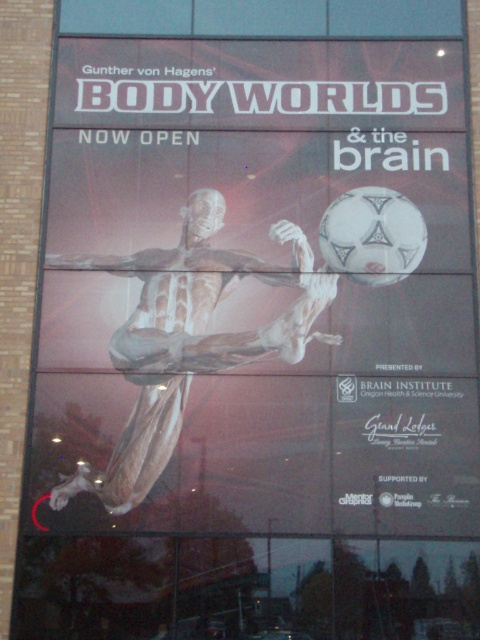
Is point (394, 68) in front of point (120, 364)?

No, it is not.

The image size is (480, 640). Describe the element at coordinates (257, 291) in the screenshot. I see `transparent plastic figure at lower left` at that location.

You are a GUI agent. You are given a task and a screenshot of the screen. Output one action in this format:
    pyautogui.click(x=<x>, y=<y>)
    Task: Click on the transparent plastic figure at lower left
    Image resolution: width=480 pixels, height=640 pixels.
    Given the screenshot: What is the action you would take?
    pyautogui.click(x=257, y=291)